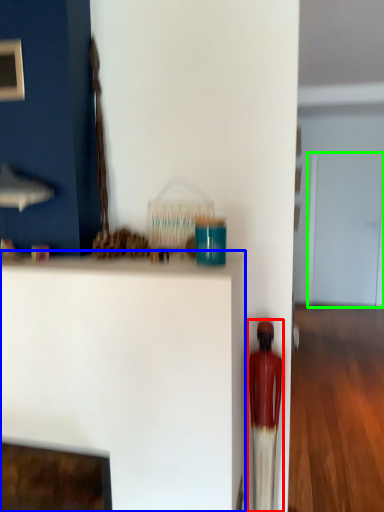
Question: Considering the real-world distances, which object is farthest from toy (highlighted by a red box)? furniture (highlighted by a blue box) or glass door (highlighted by a green box)?

Choices:
 (A) furniture
 (B) glass door

Answer: (B)